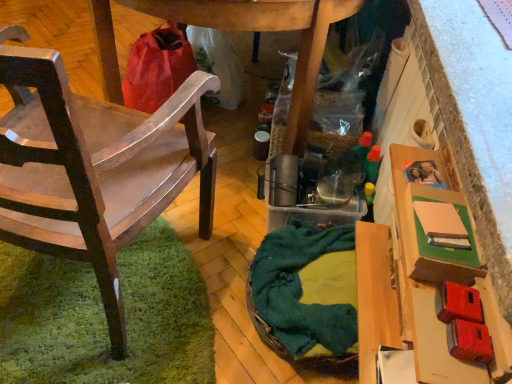
Question: Is matte brown cardboard box at right in front of or behind green woven basket at center in the image?

Choices:
 (A) front
 (B) behind

Answer: (A)

Question: From their relative heights in the image, would you say matte brown cardboard box at right is taller or shorter than green woven basket at center?

Choices:
 (A) short
 (B) tall

Answer: (B)

Question: Which object is positioned farthest from the matte brown cardboard box at right?

Choices:
 (A) green woven basket at center
 (B) wooden chair at left

Answer: (B)

Question: Based on their relative distances, which object is nearer to the green woven basket at center?

Choices:
 (A) matte brown cardboard box at right
 (B) wooden chair at left

Answer: (A)